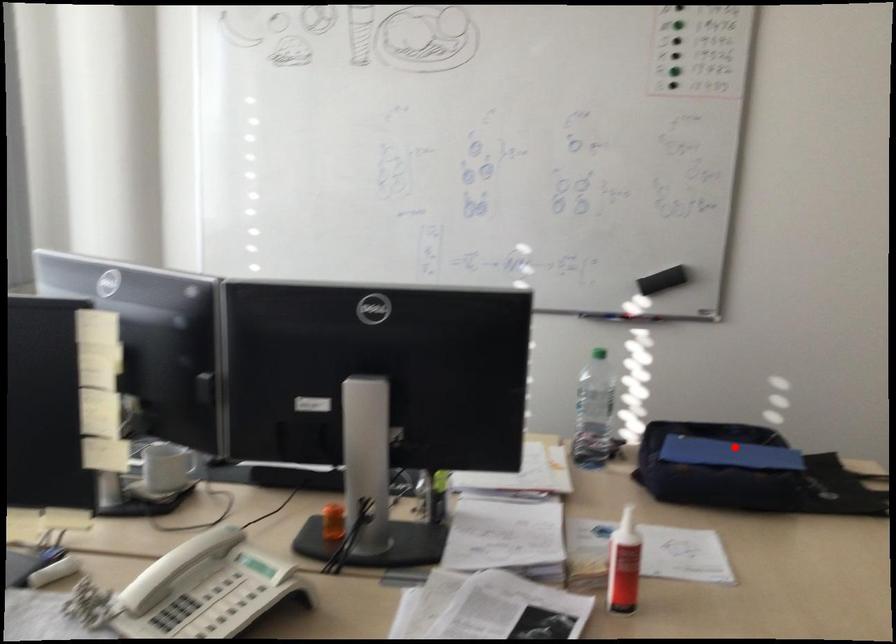
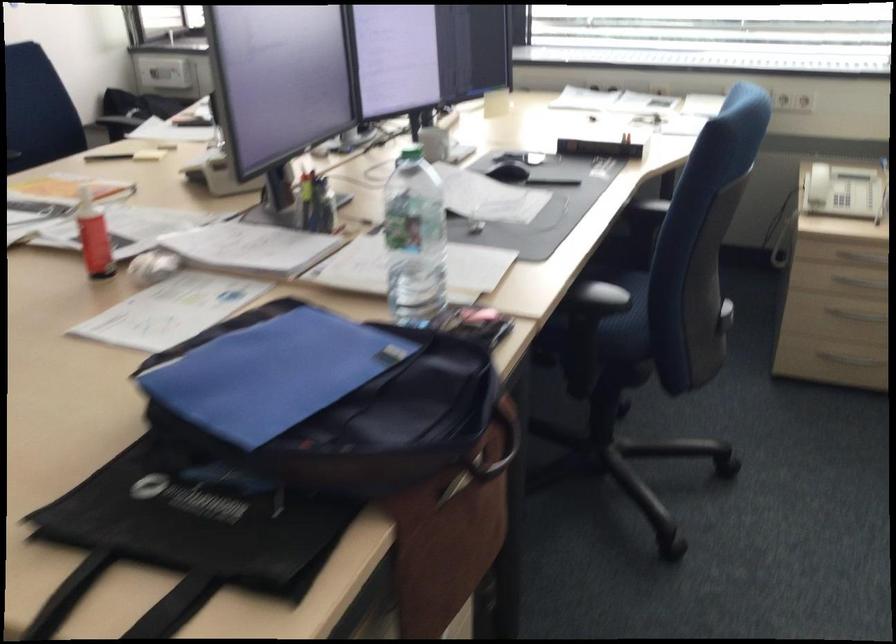
In the second image, find the point that corresponds to the highlighted location in the first image.

(271, 374)